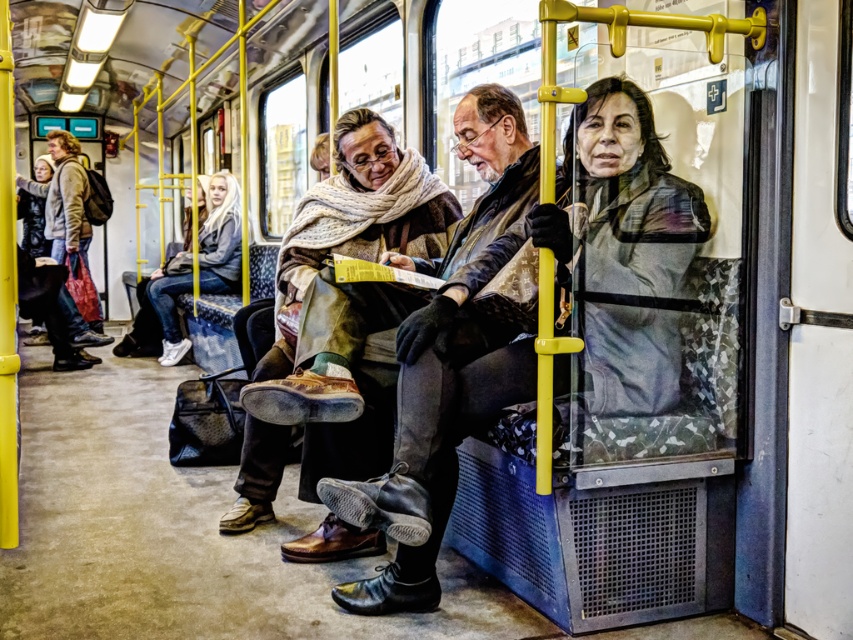
Question: Is leather jacket at center smaller than white denim jeans at left?

Choices:
 (A) no
 (B) yes

Answer: (B)

Question: Among these points, which one is nearest to the camera?

Choices:
 (A) (428, 340)
 (B) (222, 200)

Answer: (A)

Question: Is leather jacket at center closer to the viewer compared to white denim jeans at left?

Choices:
 (A) no
 (B) yes

Answer: (B)

Question: Is leather jacket at center further to camera compared to white denim jeans at left?

Choices:
 (A) yes
 (B) no

Answer: (B)